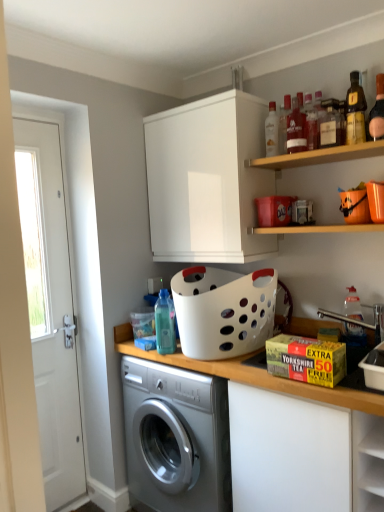
Question: Is white matte countertop at center surrounding wooden shelf at upper right, which appears as the 1th shelf when viewed from the top?

Choices:
 (A) no
 (B) yes

Answer: (A)

Question: Is white matte countertop at center next to wooden shelf at upper right, the second shelf when ordered from bottom to top?

Choices:
 (A) yes
 (B) no

Answer: (B)

Question: Is white matte countertop at center not close to wooden shelf at upper right, which appears as the 1th shelf when viewed from the top?

Choices:
 (A) no
 (B) yes

Answer: (A)

Question: From the image's perspective, is white matte countertop at center above wooden shelf at upper right, the second shelf when ordered from bottom to top?

Choices:
 (A) no
 (B) yes

Answer: (A)

Question: Is white matte countertop at center not inside wooden shelf at upper right, the second shelf when ordered from bottom to top?

Choices:
 (A) no
 (B) yes

Answer: (B)

Question: From the image's perspective, is white matte countertop at center located beneath wooden shelf at upper right, the second shelf when ordered from bottom to top?

Choices:
 (A) yes
 (B) no

Answer: (A)

Question: Is matte glass bottle at upper center, which ranks as the 4th bottle in left-to-right order, outside white glossy door at left?

Choices:
 (A) yes
 (B) no

Answer: (A)

Question: Is matte glass bottle at upper center, which is counted as the 6th bottle, starting from the right, positioned with its back to white glossy door at left?

Choices:
 (A) no
 (B) yes

Answer: (A)

Question: Can you confirm if matte glass bottle at upper center, which is counted as the 6th bottle, starting from the right, is wider than white glossy door at left?

Choices:
 (A) no
 (B) yes

Answer: (A)

Question: Does matte glass bottle at upper center, which is counted as the 6th bottle, starting from the right, touch white glossy door at left?

Choices:
 (A) no
 (B) yes

Answer: (A)

Question: Is matte glass bottle at upper center, which is counted as the 6th bottle, starting from the right, facing towards white glossy door at left?

Choices:
 (A) yes
 (B) no

Answer: (B)

Question: Can you confirm if matte glass bottle at upper center, which ranks as the 4th bottle in left-to-right order, is shorter than white glossy door at left?

Choices:
 (A) yes
 (B) no

Answer: (A)

Question: Is the depth of white glossy door at left less than that of wooden shelf at upper right, which ranks as the first shelf in bottom-to-top order?

Choices:
 (A) yes
 (B) no

Answer: (B)